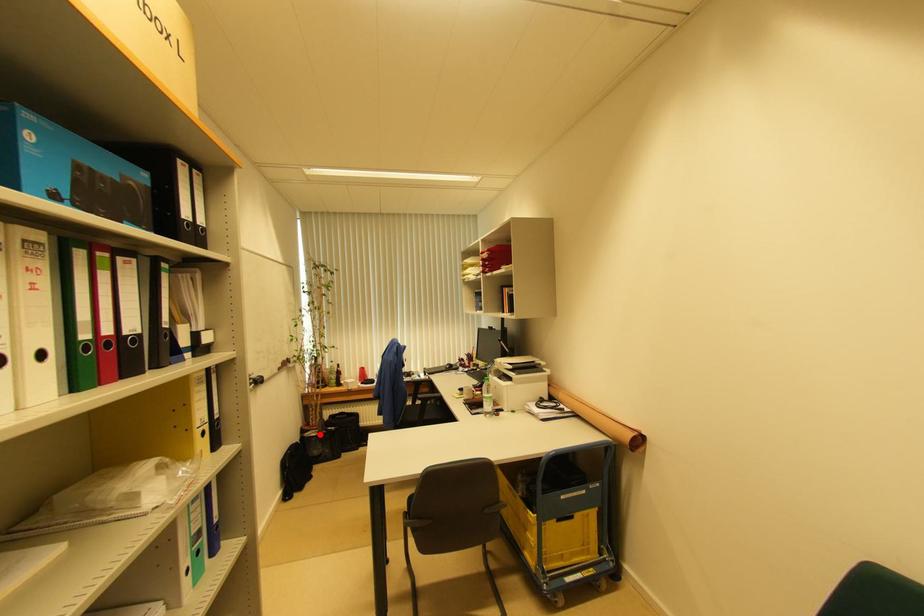
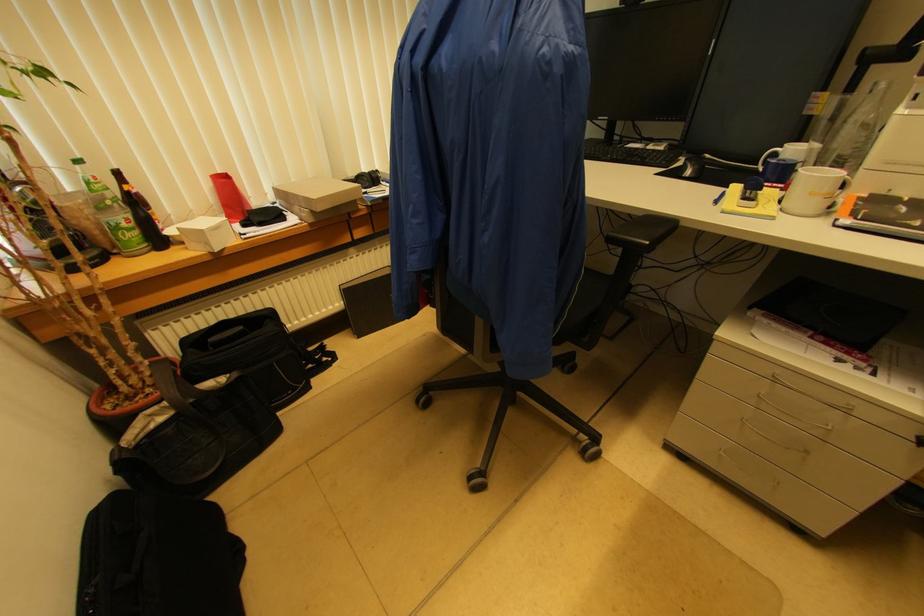
Where in the second image is the point corresponding to the highlighted location from the first image?

(175, 408)